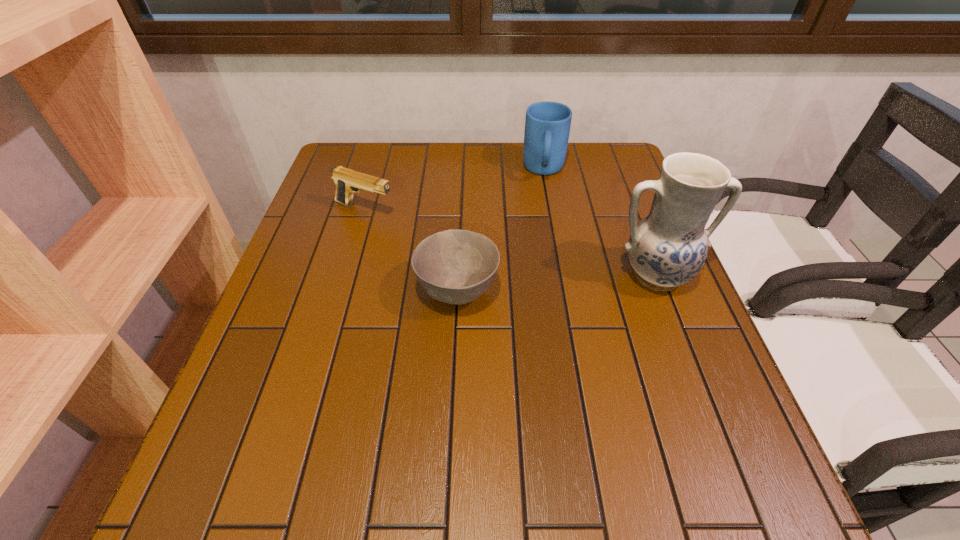
In order to click on free point between the pottery and the leftmost object in this screenshot , I will do `click(511, 242)`.

Locate an element on the screen. This screenshot has width=960, height=540. free area in between the tallest object and the third shortest object is located at coordinates (600, 223).

The height and width of the screenshot is (540, 960). I want to click on vacant space that's between the farthest object and the second object from left to right, so (x=501, y=231).

This screenshot has height=540, width=960. What are the coordinates of `the third closest object to the rightmost object` in the screenshot? It's located at (347, 181).

Point out which object is positioned as the second nearest to the second tallest object. Please provide its 2D coordinates. Your answer should be formatted as a tuple, i.e. [(x, y)], where the tuple contains the x and y coordinates of a point satisfying the conditions above.

[(455, 266)]

You are a GUI agent. You are given a task and a screenshot of the screen. Output one action in this format:
    pyautogui.click(x=<x>, y=<y>)
    Task: Click on the blank space that satisfies the following two spatial constraints: 1. on the back side of the third object from left to right; 2. on the left side of the bowl
    
    Given the screenshot: What is the action you would take?
    pyautogui.click(x=464, y=171)

Image resolution: width=960 pixels, height=540 pixels. What are the coordinates of `vacant space that satisfies the following two spatial constraints: 1. on the back side of the pottery; 2. on the right side of the bowl` in the screenshot? It's located at tap(458, 275).

Locate an element on the screen. free location that satisfies the following two spatial constraints: 1. on the back side of the second farthest object; 2. on the left side of the third object from left to right is located at coordinates (376, 171).

You are a GUI agent. You are given a task and a screenshot of the screen. Output one action in this format:
    pyautogui.click(x=<x>, y=<y>)
    Task: Click on the blank space that satisfies the following two spatial constraints: 1. on the front side of the pistol; 2. on the right side of the pottery
    The width and height of the screenshot is (960, 540).
    Given the screenshot: What is the action you would take?
    pyautogui.click(x=346, y=275)

Image resolution: width=960 pixels, height=540 pixels. In order to click on vacant space that satisfies the following two spatial constraints: 1. on the front side of the tallest object; 2. on the right side of the leftmost object in this screenshot , I will do `click(346, 275)`.